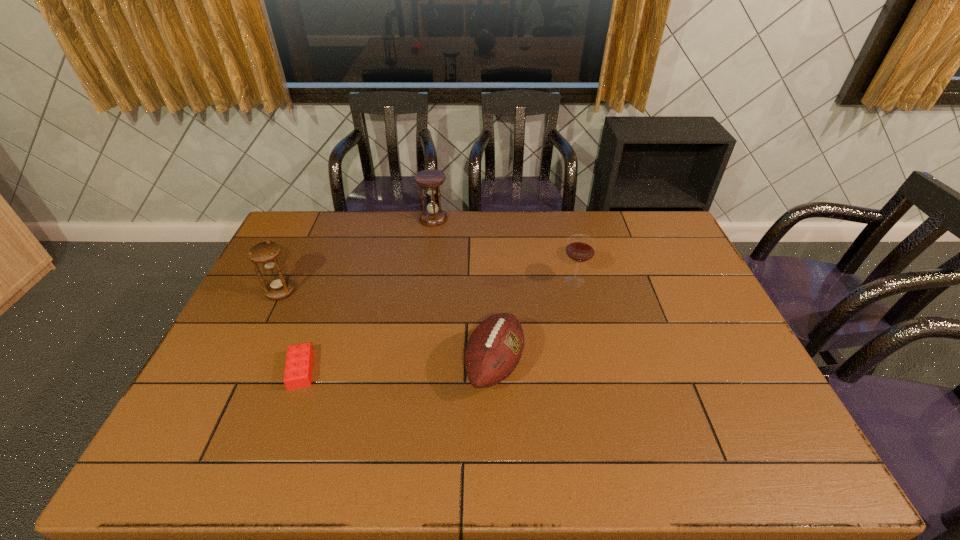
In the image, there is a desktop. Identify the location of free space at the far right corner. This screenshot has width=960, height=540. (x=665, y=235).

Locate an element on the screen. The height and width of the screenshot is (540, 960). free area in between the left hourglass and the football (American) is located at coordinates (388, 329).

Locate an element on the screen. This screenshot has width=960, height=540. vacant space that's between the farther hourglass and the left hourglass is located at coordinates (357, 255).

At what (x,y) coordinates should I click in order to perform the action: click on vacant region between the left hourglass and the fourth object from left to right. Please return your answer as a coordinate pair (x, y). The image size is (960, 540). Looking at the image, I should click on (388, 329).

This screenshot has height=540, width=960. In order to click on vacant area between the wineglass and the football (American) in this screenshot , I will do `click(535, 323)`.

Find the location of a particular element. The image size is (960, 540). free space between the fourth object from left to right and the farthest object is located at coordinates (464, 292).

You are a GUI agent. You are given a task and a screenshot of the screen. Output one action in this format:
    pyautogui.click(x=<x>, y=<y>)
    Task: Click on the vacant area between the farther hourglass and the second object from left to right
    Image resolution: width=960 pixels, height=540 pixels.
    Given the screenshot: What is the action you would take?
    pyautogui.click(x=368, y=294)

Where is `empty space that is in between the football (American) and the third object from right to left`? The width and height of the screenshot is (960, 540). empty space that is in between the football (American) and the third object from right to left is located at coordinates (464, 292).

I want to click on vacant space in between the Lego and the rightmost object, so click(438, 326).

Where is `free space between the left hourglass and the wineglass`? free space between the left hourglass and the wineglass is located at coordinates (427, 286).